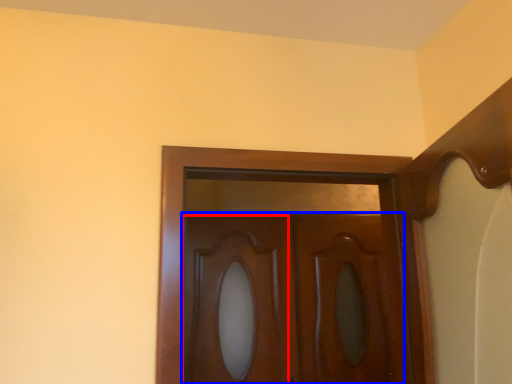
Question: Which of the following is the farthest to the observer, cabinetry (highlighted by a red box) or door (highlighted by a blue box)?

Choices:
 (A) cabinetry
 (B) door

Answer: (A)